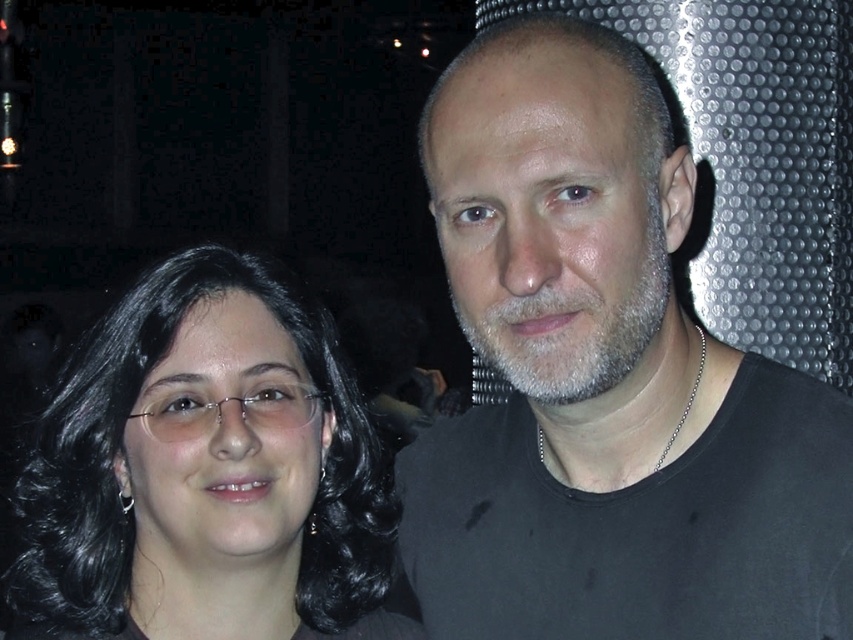
Question: Does black matte shirt at upper right appear on the right side of black hair at left?

Choices:
 (A) no
 (B) yes

Answer: (B)

Question: Can you confirm if black matte shirt at upper right is bigger than black hair at left?

Choices:
 (A) no
 (B) yes

Answer: (B)

Question: Which of the following is the farthest from the observer?

Choices:
 (A) (316, 616)
 (B) (508, 403)

Answer: (B)

Question: Can you confirm if black matte shirt at upper right is positioned to the right of black hair at left?

Choices:
 (A) yes
 (B) no

Answer: (A)